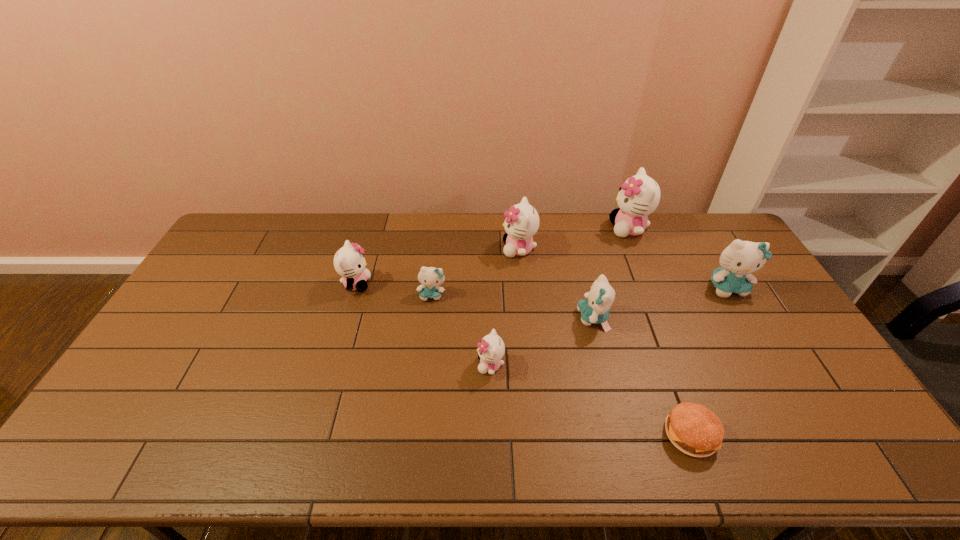
You are a GUI agent. You are given a task and a screenshot of the screen. Output one action in this format:
    pyautogui.click(x=<x>, y=<y>)
    Task: Click on the free space between the tallest object and the fourth kitten from right to left
    The height and width of the screenshot is (540, 960).
    Given the screenshot: What is the action you would take?
    pyautogui.click(x=574, y=239)

I want to click on free spot between the second biggest white kitten and the rightmost object, so click(623, 268).

Find the location of a particular element. vacant point located between the sixth kitten from right to left and the fifth object from right to left is located at coordinates (475, 272).

At what (x,y) coordinates should I click in order to perform the action: click on empty space between the smallest blue kitten and the second biggest white kitten. Please return your answer as a coordinate pair (x, y). The image size is (960, 540). Looking at the image, I should click on (475, 272).

This screenshot has height=540, width=960. I want to click on vacant area that lies between the rightmost object and the hamburger, so pos(708,361).

Locate an element on the screen. The width and height of the screenshot is (960, 540). vacant space in between the biggest blue kitten and the nearest object is located at coordinates (708, 361).

Where is `empty space that is in between the third kitten from left to right and the leftmost blue kitten`? The height and width of the screenshot is (540, 960). empty space that is in between the third kitten from left to right and the leftmost blue kitten is located at coordinates (461, 330).

This screenshot has width=960, height=540. Identify the location of free area in between the second white kitten from right to left and the leftmost blue kitten. (475, 272).

Where is `vacant space that's between the rightmost kitten and the seventh object from right to left`? vacant space that's between the rightmost kitten and the seventh object from right to left is located at coordinates (580, 292).

Locate an element on the screen. This screenshot has width=960, height=540. the seventh closest object to the rightmost kitten is located at coordinates (349, 263).